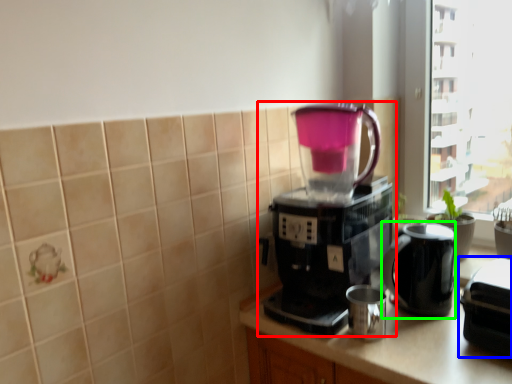
Question: Which object is the closest to the coffee maker (highlighted by a red box)? Choose among these: appliance (highlighted by a blue box) or jug (highlighted by a green box).

Choices:
 (A) appliance
 (B) jug

Answer: (B)